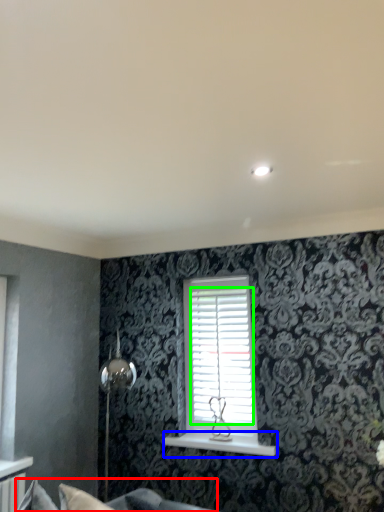
Question: Which is farther away from couch (highlighted by a red box)? window sill (highlighted by a blue box) or shutter (highlighted by a green box)?

Choices:
 (A) window sill
 (B) shutter

Answer: (B)